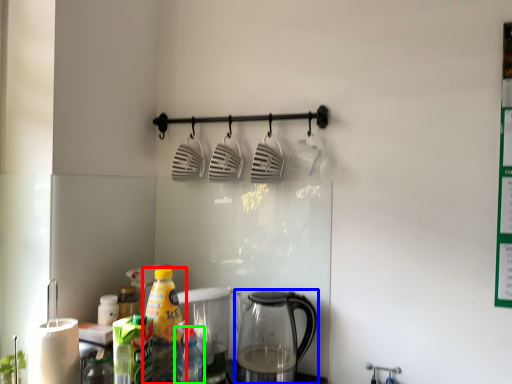
Question: Considering the real-world distances, which object is closest to bottle (highlighted by a red box)? kettle (highlighted by a blue box) or bottle (highlighted by a green box).

Choices:
 (A) kettle
 (B) bottle

Answer: (B)